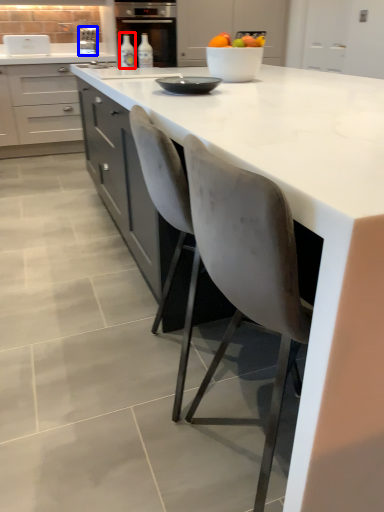
Question: Which object is further to the camera taking this photo, bottle (highlighted by a red box) or kitchen appliance (highlighted by a blue box)?

Choices:
 (A) bottle
 (B) kitchen appliance

Answer: (B)